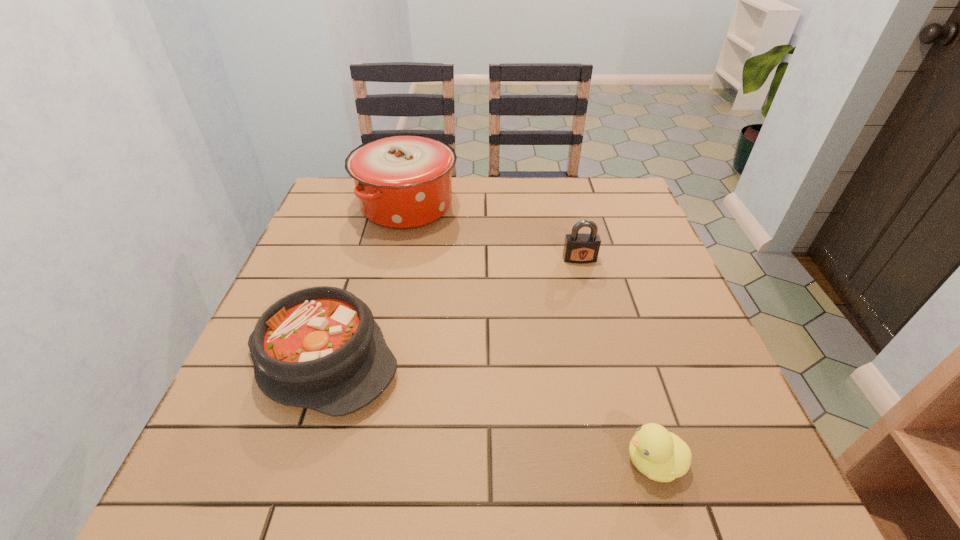
In the image, there is a desktop. Find the location of `vacant region at the left edge`. vacant region at the left edge is located at coordinates (223, 417).

Where is `vacant region at the right edge`? This screenshot has height=540, width=960. vacant region at the right edge is located at coordinates (660, 334).

Where is `free space at the far right corner of the desktop`? The width and height of the screenshot is (960, 540). free space at the far right corner of the desktop is located at coordinates (614, 217).

Find the location of a particular element. This screenshot has height=540, width=960. vacant area that lies between the nearest object and the nearer casserole is located at coordinates (489, 410).

Identify the location of unoccupied area between the nearer casserole and the third nearest object. (451, 309).

I want to click on blank region between the shortest object and the nearer casserole, so click(489, 410).

Locate an element on the screen. The width and height of the screenshot is (960, 540). free space that is in between the padlock and the duckling is located at coordinates (616, 360).

I want to click on free spot between the nearer casserole and the duckling, so click(489, 410).

Locate an element on the screen. The image size is (960, 540). vacant area that lies between the farther casserole and the shortest object is located at coordinates click(531, 334).

Find the location of a particular element. free space between the duckling and the second farthest object is located at coordinates (616, 360).